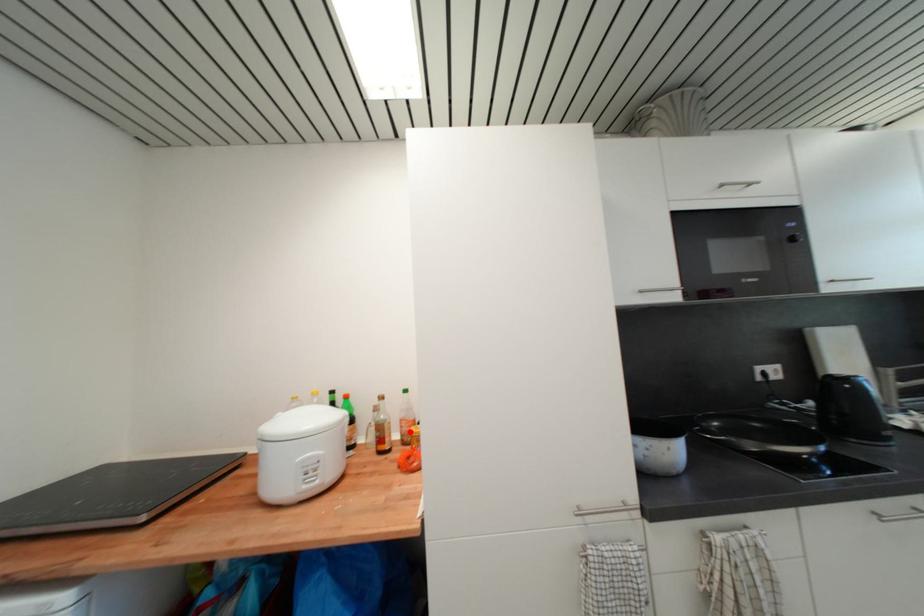
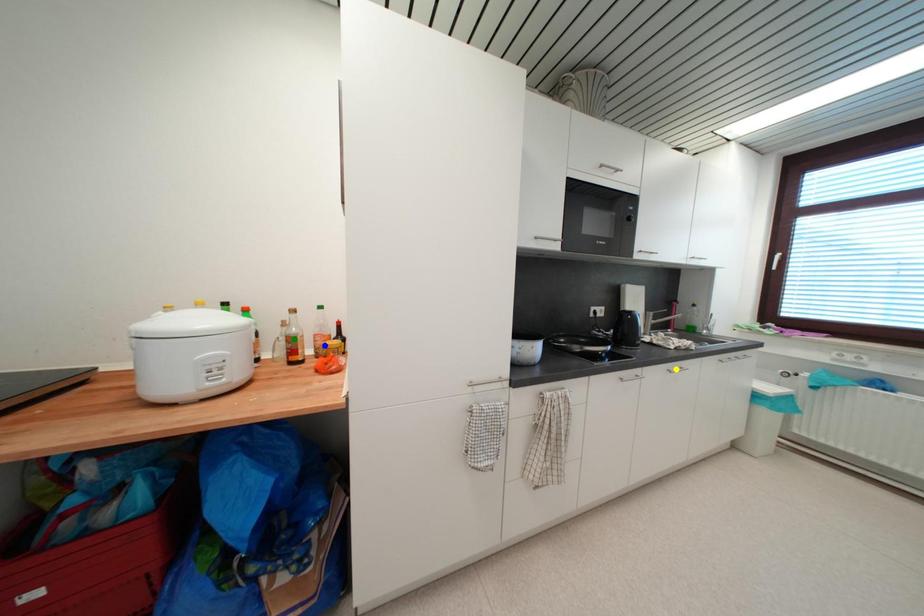
Question: I am providing you with two images of the same scene from different viewpoints. A red point is marked on the first image. You are given multiple points on the second image. Which spot in image 2 lines up with the point in image 1?

Choices:
 (A) green point
 (B) yellow point
 (C) blue point

Answer: (C)